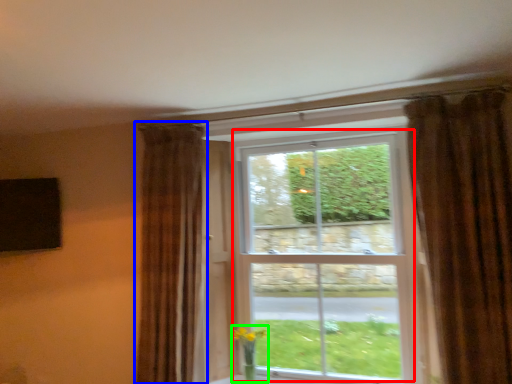
Question: Considering the real-world distances, which object is farthest from bay window (highlighted by a red box)? curtain (highlighted by a blue box) or floral arrangement (highlighted by a green box)?

Choices:
 (A) curtain
 (B) floral arrangement

Answer: (B)